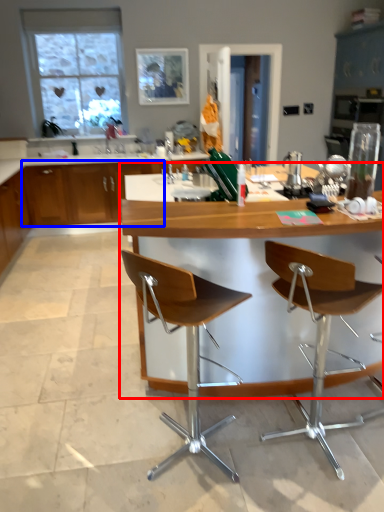
Question: Which object is further to the camera taking this photo, table (highlighted by a red box) or cabinetry (highlighted by a blue box)?

Choices:
 (A) table
 (B) cabinetry

Answer: (B)